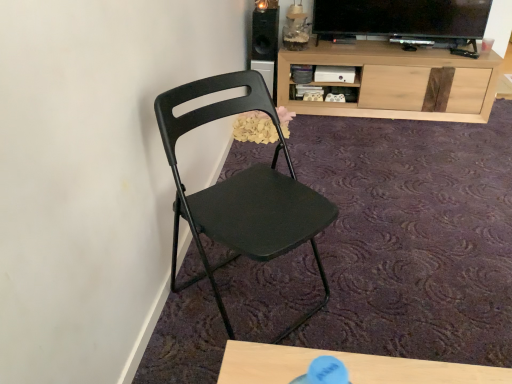
Question: Is black matte speaker at upper center further to camera compared to light wood cabinet at upper right?

Choices:
 (A) no
 (B) yes

Answer: (B)

Question: Considering the relative sizes of black matte speaker at upper center and light wood cabinet at upper right in the image provided, is black matte speaker at upper center wider than light wood cabinet at upper right?

Choices:
 (A) yes
 (B) no

Answer: (B)

Question: Can light wood cabinet at upper right be found inside black matte speaker at upper center?

Choices:
 (A) yes
 (B) no

Answer: (B)

Question: Are black matte speaker at upper center and light wood cabinet at upper right far apart?

Choices:
 (A) yes
 (B) no

Answer: (B)

Question: Considering the relative sizes of black matte speaker at upper center and light wood cabinet at upper right in the image provided, is black matte speaker at upper center taller than light wood cabinet at upper right?

Choices:
 (A) no
 (B) yes

Answer: (A)

Question: From a real-world perspective, relative to light wood cabinet at upper right, is black matte speaker at upper center vertically above or below?

Choices:
 (A) above
 (B) below

Answer: (A)

Question: From the image's perspective, is black matte speaker at upper center positioned above or below light wood cabinet at upper right?

Choices:
 (A) above
 (B) below

Answer: (A)

Question: Considering the positions of black matte speaker at upper center and light wood cabinet at upper right in the image, is black matte speaker at upper center bigger or smaller than light wood cabinet at upper right?

Choices:
 (A) big
 (B) small

Answer: (B)

Question: In terms of width, does black matte speaker at upper center look wider or thinner when compared to light wood cabinet at upper right?

Choices:
 (A) wide
 (B) thin

Answer: (B)

Question: Considering the positions of light wood cabinet at upper right and black matte speaker at upper center in the image, is light wood cabinet at upper right wider or thinner than black matte speaker at upper center?

Choices:
 (A) wide
 (B) thin

Answer: (A)

Question: From a real-world perspective, is light wood cabinet at upper right above or below black matte speaker at upper center?

Choices:
 (A) below
 (B) above

Answer: (A)

Question: Considering the positions of light wood cabinet at upper right and black matte speaker at upper center in the image, is light wood cabinet at upper right taller or shorter than black matte speaker at upper center?

Choices:
 (A) tall
 (B) short

Answer: (A)

Question: Relative to black matte speaker at upper center, is light wood cabinet at upper right in front or behind?

Choices:
 (A) front
 (B) behind

Answer: (A)

Question: From a real-world perspective, is light wood cabinet at upper right positioned above or below matte black folding chair at center?

Choices:
 (A) above
 (B) below

Answer: (B)

Question: Would you say light wood cabinet at upper right is inside or outside matte black folding chair at center?

Choices:
 (A) outside
 (B) inside

Answer: (A)